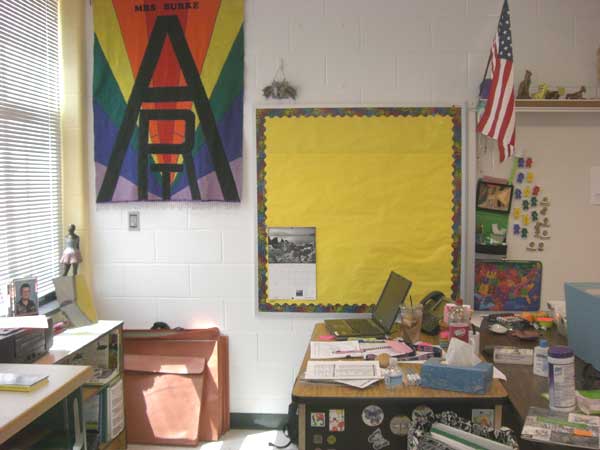
Pinpoint the coordinates of what you use to type on a laptop in the image. Your answer should be formatted as a list of tuples, i.e. [(x1, y1), (x2, y2), ...], where each tuple contains the x and y coordinates of a point satisfying the conditions above.

[(362, 326)]